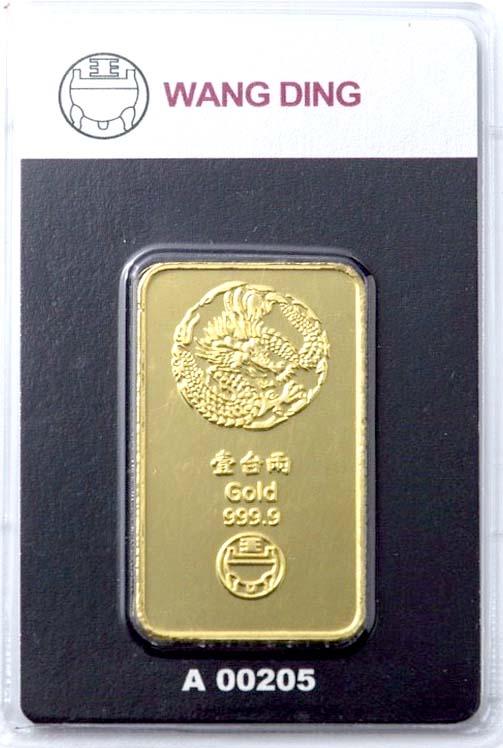
Locate an element on the screen. The width and height of the screenshot is (503, 748). plastic cover is located at coordinates (156, 251).